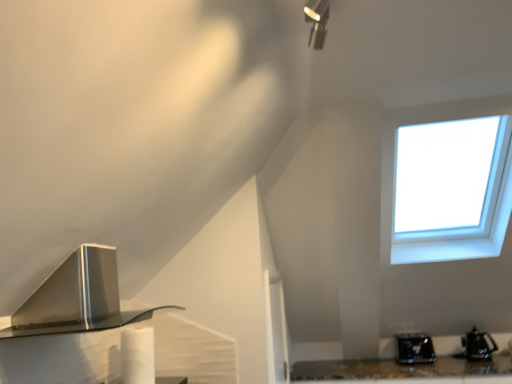
Question: Is shiny black toaster at lower right, the first appliance positioned from the left, beside black plastic kettle at lower right, placed as the 1th appliance when sorted from right to left?

Choices:
 (A) yes
 (B) no

Answer: (B)

Question: Is shiny black toaster at lower right, which is the 2th appliance from right to left, further to the viewer compared to black plastic kettle at lower right, placed as the 1th appliance when sorted from right to left?

Choices:
 (A) yes
 (B) no

Answer: (A)

Question: Is shiny black toaster at lower right, the first appliance positioned from the left, bigger than black plastic kettle at lower right, marked as the 2th appliance in a left-to-right arrangement?

Choices:
 (A) no
 (B) yes

Answer: (B)

Question: From a real-world perspective, does shiny black toaster at lower right, which is the 2th appliance from right to left, sit lower than black plastic kettle at lower right, marked as the 2th appliance in a left-to-right arrangement?

Choices:
 (A) no
 (B) yes

Answer: (A)

Question: Could you tell me if shiny black toaster at lower right, which is the 2th appliance from right to left, is turned towards black plastic kettle at lower right, marked as the 2th appliance in a left-to-right arrangement?

Choices:
 (A) no
 (B) yes

Answer: (A)

Question: Visually, is shiny black toaster at lower right, which is the 2th appliance from right to left, positioned to the left or to the right of satin silver range hood at lower left?

Choices:
 (A) right
 (B) left

Answer: (A)

Question: From their relative heights in the image, would you say shiny black toaster at lower right, which is the 2th appliance from right to left, is taller or shorter than satin silver range hood at lower left?

Choices:
 (A) tall
 (B) short

Answer: (B)

Question: Considering the positions of shiny black toaster at lower right, which is the 2th appliance from right to left, and satin silver range hood at lower left in the image, is shiny black toaster at lower right, which is the 2th appliance from right to left, wider or thinner than satin silver range hood at lower left?

Choices:
 (A) thin
 (B) wide

Answer: (A)

Question: From a real-world perspective, is shiny black toaster at lower right, the first appliance positioned from the left, physically located above or below satin silver range hood at lower left?

Choices:
 (A) below
 (B) above

Answer: (A)

Question: From a real-world perspective, is shiny black toaster at lower right, which is the 2th appliance from right to left, positioned above or below black plastic kettle at lower right, placed as the 1th appliance when sorted from right to left?

Choices:
 (A) above
 (B) below

Answer: (A)

Question: Choose the correct answer: Is shiny black toaster at lower right, the first appliance positioned from the left, inside black plastic kettle at lower right, marked as the 2th appliance in a left-to-right arrangement, or outside it?

Choices:
 (A) outside
 (B) inside

Answer: (A)

Question: From the image's perspective, is shiny black toaster at lower right, which is the 2th appliance from right to left, positioned above or below black plastic kettle at lower right, placed as the 1th appliance when sorted from right to left?

Choices:
 (A) above
 (B) below

Answer: (B)

Question: Considering their positions, is shiny black toaster at lower right, the first appliance positioned from the left, located in front of or behind black plastic kettle at lower right, placed as the 1th appliance when sorted from right to left?

Choices:
 (A) front
 (B) behind

Answer: (B)

Question: Based on their positions, is black plastic kettle at lower right, marked as the 2th appliance in a left-to-right arrangement, located to the left or right of shiny black toaster at lower right, which is the 2th appliance from right to left?

Choices:
 (A) left
 (B) right

Answer: (B)

Question: In terms of width, does black plastic kettle at lower right, placed as the 1th appliance when sorted from right to left, look wider or thinner when compared to shiny black toaster at lower right, the first appliance positioned from the left?

Choices:
 (A) thin
 (B) wide

Answer: (A)